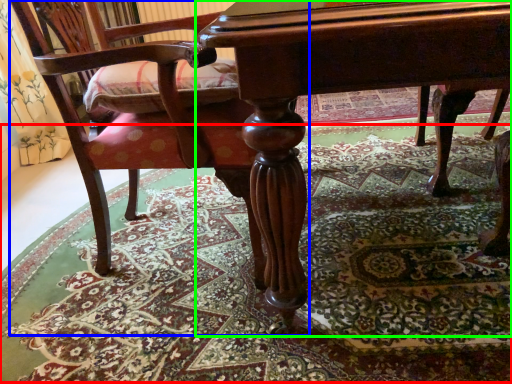
Question: Considering the real-world distances, which object is closest to mat (highlighted by a red box)? chair (highlighted by a blue box) or table (highlighted by a green box).

Choices:
 (A) chair
 (B) table

Answer: (A)